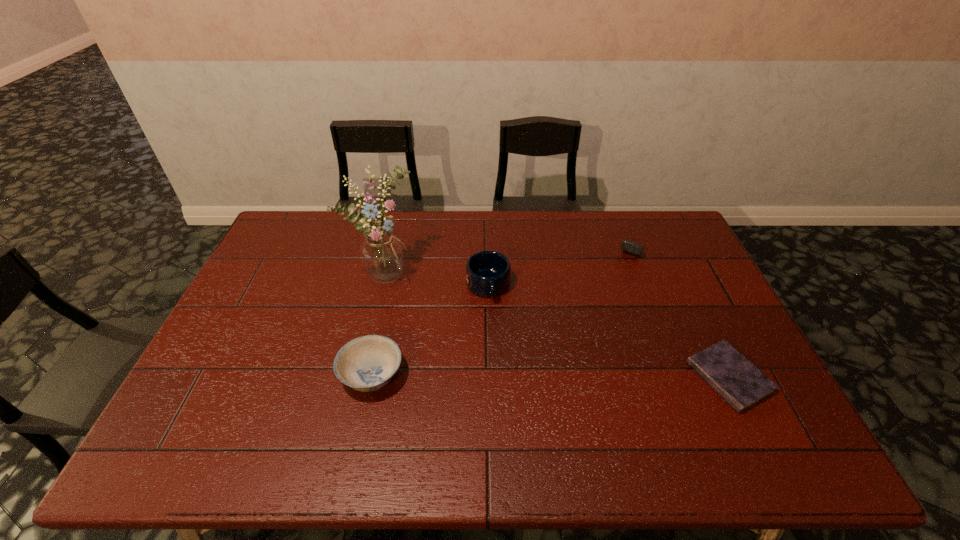
Locate an element on the screen. free location located 0.320m on the front-facing side of the webcam is located at coordinates (599, 317).

Where is `blank space located 0.250m with the handle on the side of the mug`? blank space located 0.250m with the handle on the side of the mug is located at coordinates (507, 374).

Identify the location of vacant space situated 0.230m with the handle on the side of the mug. Image resolution: width=960 pixels, height=540 pixels. (505, 368).

The height and width of the screenshot is (540, 960). What are the coordinates of `free space located 0.070m with the handle on the side of the mug` in the screenshot? It's located at (495, 322).

In order to click on vacant space located on the front-facing side of the tallest object in this screenshot , I will do `click(516, 343)`.

You are a GUI agent. You are given a task and a screenshot of the screen. Output one action in this format:
    pyautogui.click(x=<x>, y=<y>)
    Task: Click on the blank area located 0.270m on the front-facing side of the tallest object
    The height and width of the screenshot is (540, 960).
    Given the screenshot: What is the action you would take?
    (x=478, y=322)

I want to click on free space located 0.340m on the front-facing side of the tallest object, so click(497, 333).

I want to click on object present at the far edge, so click(634, 248).

Identify the location of bowl at the near edge. (368, 363).

Where is `diary positioned at the near edge`? The image size is (960, 540). diary positioned at the near edge is located at coordinates (741, 384).